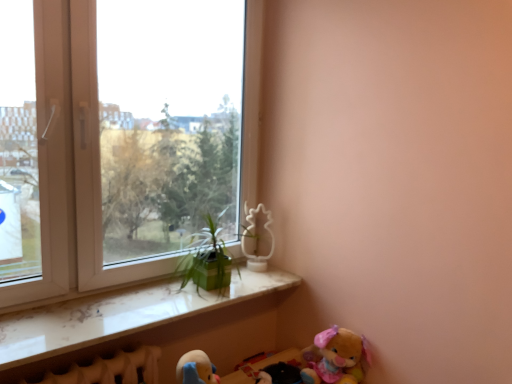
Where is `empty space that is in between green matte plant at center and white plastic window at upper left`? empty space that is in between green matte plant at center and white plastic window at upper left is located at coordinates (168, 299).